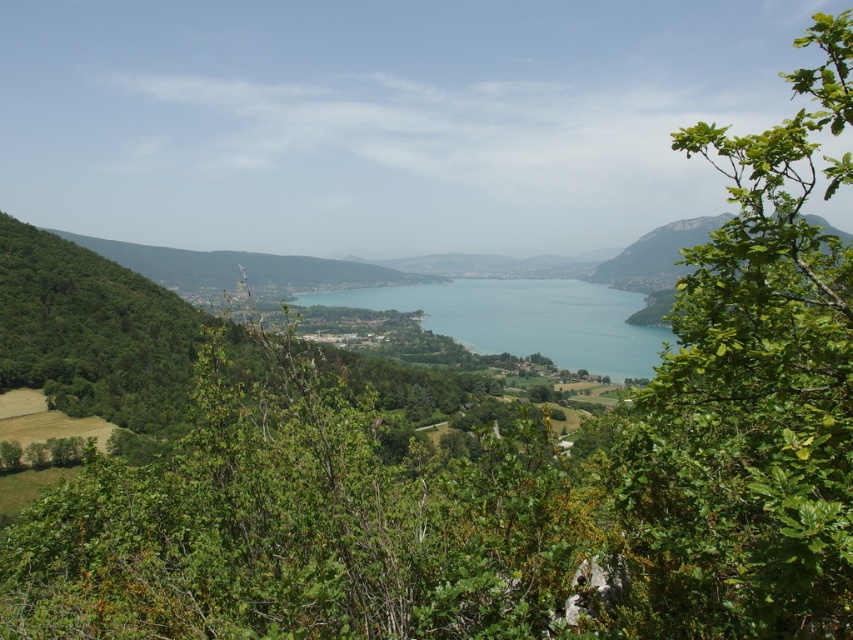
From the picture: You are standing at the point marked by coordinates point (300, 525) in the image. What object are you directly facing?

The point (300, 525) corresponds to the green leafy tree at center, so you are directly facing the green leafy tree at center.

You are standing in the serene landscape and want to throw a pebble into the blue water at center. If you stand near the green leafy tree at right, will the tree block your view of the water?

The green leafy tree at right is positioned over blue water at center, so standing near it might block your direct line of sight to the water.

You are a photographer standing at the edge of the lake in the serene landscape. You notice two points marked in the image. Which point, point (846, 179) or point (552, 333), is closer to you?

Point (846, 179) is closer to the camera than point (552, 333), so it is closer to you.